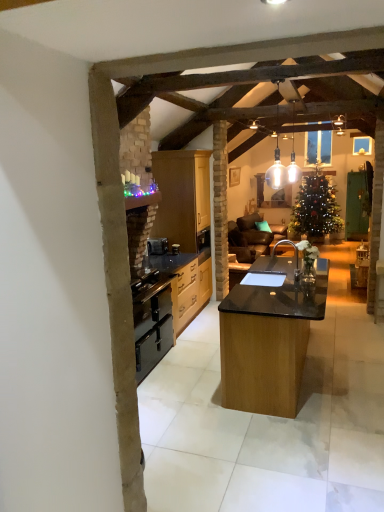
Question: From the image's perspective, is black matte oven at center positioned above or below matte wood cabinets at center, which is the 1th cabinetry in top-to-bottom order?

Choices:
 (A) above
 (B) below

Answer: (B)

Question: From a real-world perspective, relative to matte wood cabinets at center, which appears as the 2th cabinetry when ordered from the bottom, is black matte oven at center vertically above or below?

Choices:
 (A) above
 (B) below

Answer: (B)

Question: Which object is the closest to the black matte oven at center?

Choices:
 (A) black wood cabinets at center, the 2th cabinetry in the top-to-bottom sequence
 (B) black granite table at center
 (C) black matte sink at center
 (D) matte wood cabinets at center, which appears as the 2th cabinetry when ordered from the bottom
 (E) black matte oven at center

Answer: (A)

Question: Which is farther from the matte wood cabinets at center, which is the 1th cabinetry in top-to-bottom order?

Choices:
 (A) black matte oven at center
 (B) black granite table at center
 (C) black matte sink at center
 (D) black wood cabinets at center, the 2th cabinetry in the top-to-bottom sequence
 (E) black matte oven at center

Answer: (B)